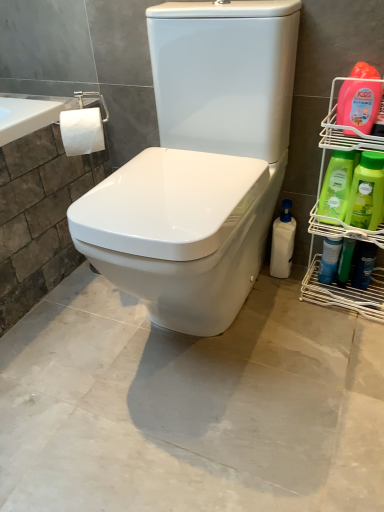
Question: Considering the positions of point (327, 212) and point (352, 131), is point (327, 212) closer or farther from the camera than point (352, 131)?

Choices:
 (A) closer
 (B) farther

Answer: (B)

Question: Looking at the image, does green plastic bottles at right, placed as the second cleaning product when sorted from left to right, seem bigger or smaller compared to green plastic bottles at right?

Choices:
 (A) small
 (B) big

Answer: (A)

Question: Estimate the real-world distances between objects in this image. Which object is farther from the green plastic bottles at right?

Choices:
 (A) blue glossy spray bottle at right, arranged as the 5th cleaning product when viewed from the left
 (B) matte orange bottle at right, the third cleaning product from the left
 (C) blue glossy spray can at lower right
 (D) white matte toilet paper at upper left
 (E) dark blue plastic can at lower right, arranged as the 6th cleaning product when viewed from the left

Answer: (D)

Question: Estimate the real-world distances between objects in this image. Which object is closer to the white matte toilet paper at upper left?

Choices:
 (A) blue glossy spray bottle at right, arranged as the second cleaning product when viewed from the right
 (B) blue glossy spray can at lower right
 (C) green matte bottle at right, arranged as the 3th cleaning product when viewed from the right
 (D) matte orange bottle at right, the third cleaning product from the left
 (E) white plastic bottle at lower right, which ranks as the 6th cleaning product in right-to-left order

Answer: (E)